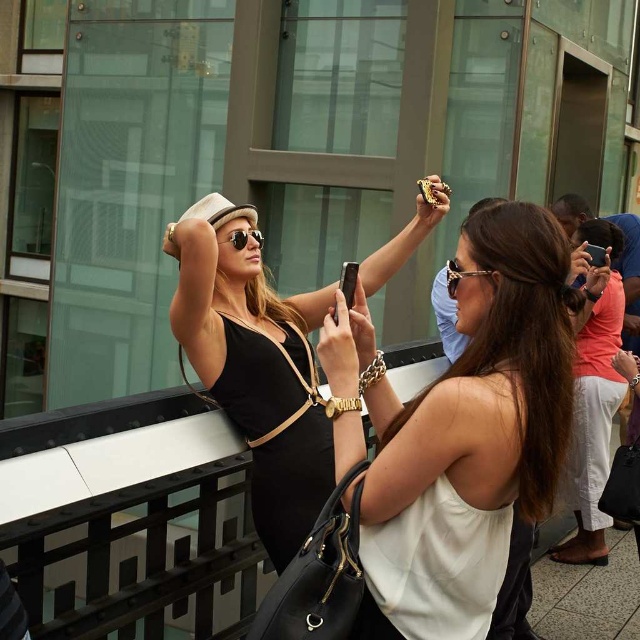
Question: Is white matte tank top at center below white cotton pants at lower right?

Choices:
 (A) yes
 (B) no

Answer: (B)

Question: Does white matte tank top at center appear under matte black sunglasses at upper center?

Choices:
 (A) no
 (B) yes

Answer: (B)

Question: Among these points, which one is nearest to the camera?

Choices:
 (A) (253, 228)
 (B) (536, 408)
 (C) (586, 548)
 (D) (282, 564)

Answer: (B)

Question: Which of these objects is positioned closest to the white cotton pants at lower right?

Choices:
 (A) matte black dress at center
 (B) white matte tank top at center

Answer: (A)

Question: Does white matte tank top at center appear on the right side of white cotton pants at lower right?

Choices:
 (A) no
 (B) yes

Answer: (A)

Question: Which object is the farthest from the matte black sunglasses at upper center?

Choices:
 (A) white cotton pants at lower right
 (B) white matte tank top at center

Answer: (A)